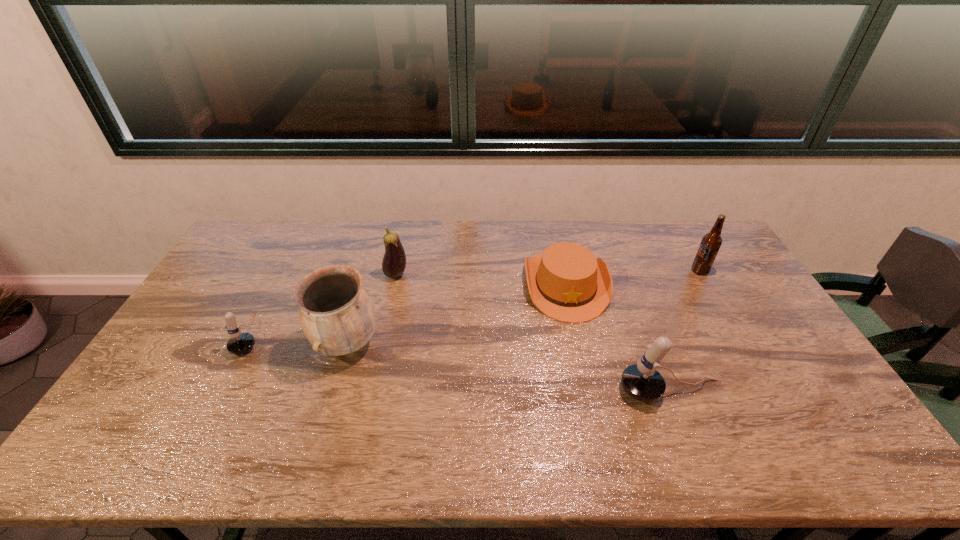
Please determine a free point for an extra microphone to ensure balance. Please provide its 2D coordinates. Your answer should be formatted as a tuple, i.e. [(x, y)], where the tuple contains the x and y coordinates of a point satisfying the conditions above.

[(448, 361)]